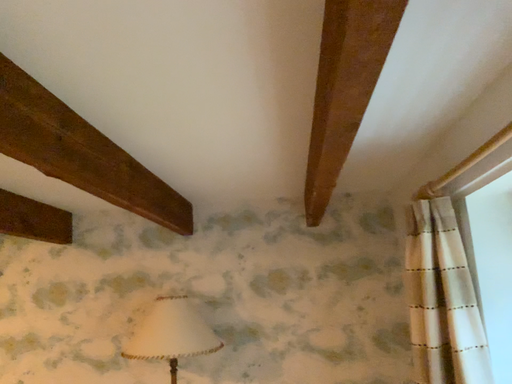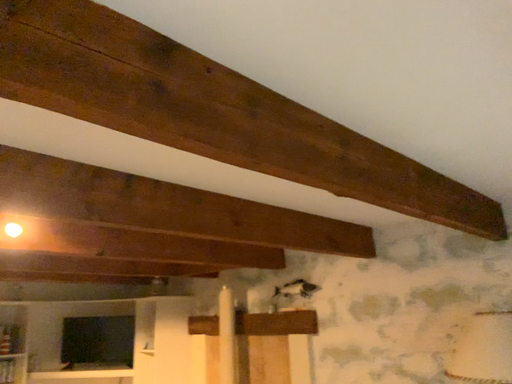
Question: Which way did the camera rotate in the video?

Choices:
 (A) rotated left
 (B) rotated right

Answer: (A)